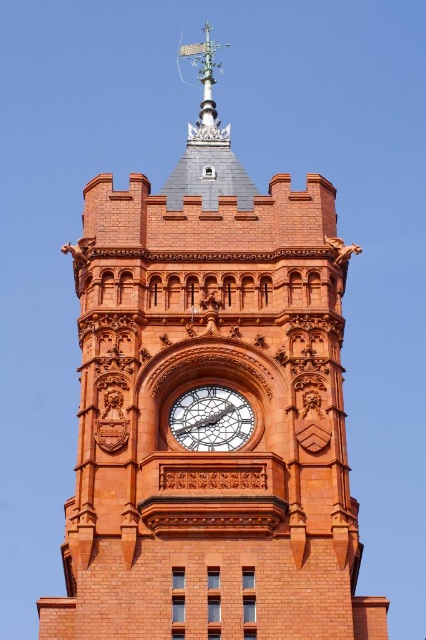
Is silver metallic weathervane at upper center in front of polished brass clock at center?

No, it is not.

Is point (204, 102) positioned in front of point (219, 428)?

No, (204, 102) is behind (219, 428).

Which is behind, point (229, 163) or point (201, 433)?

Positioned behind is point (229, 163).

The height and width of the screenshot is (640, 426). I want to click on silver metallic weathervane at upper center, so click(207, 147).